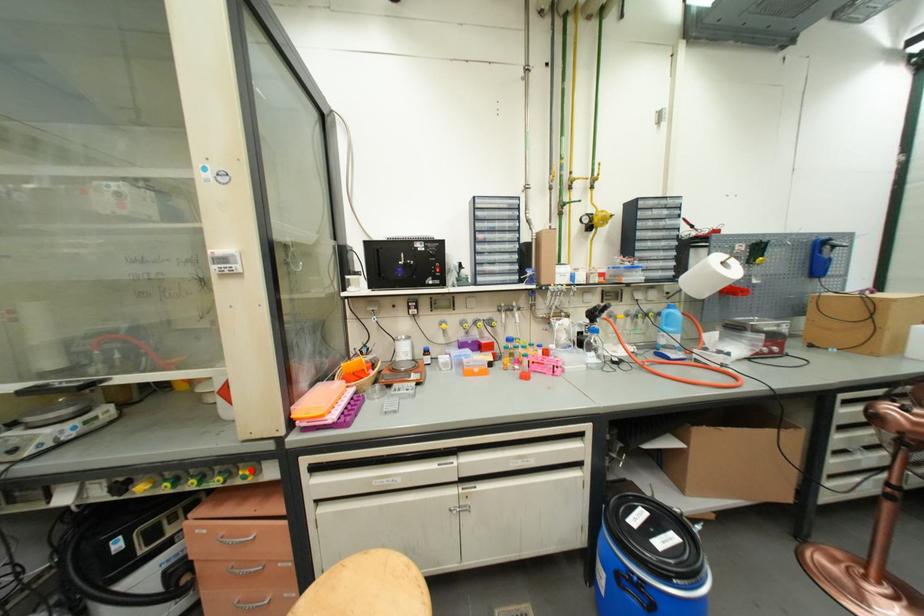
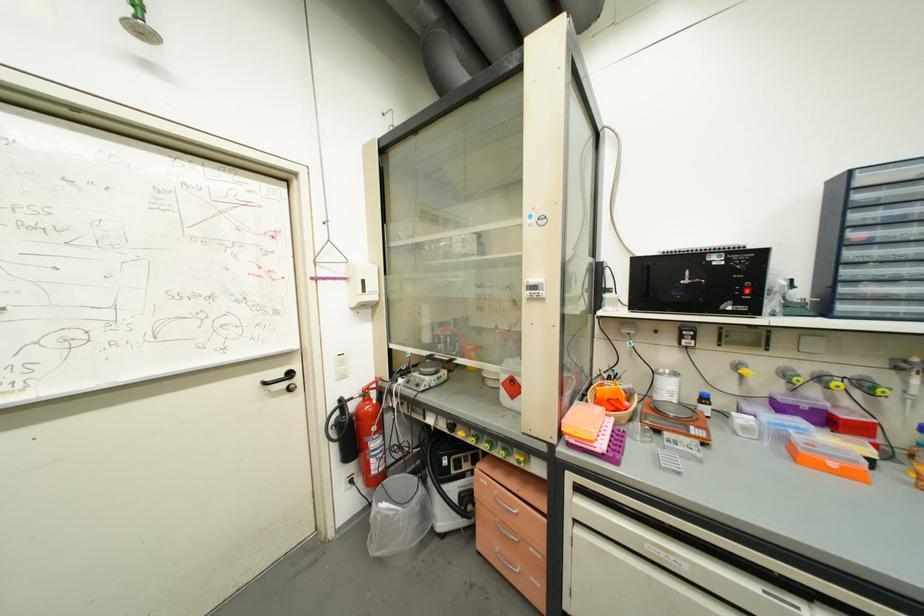
In the second image, find the point that corresponds to the highlighted location in the first image.

(525, 456)